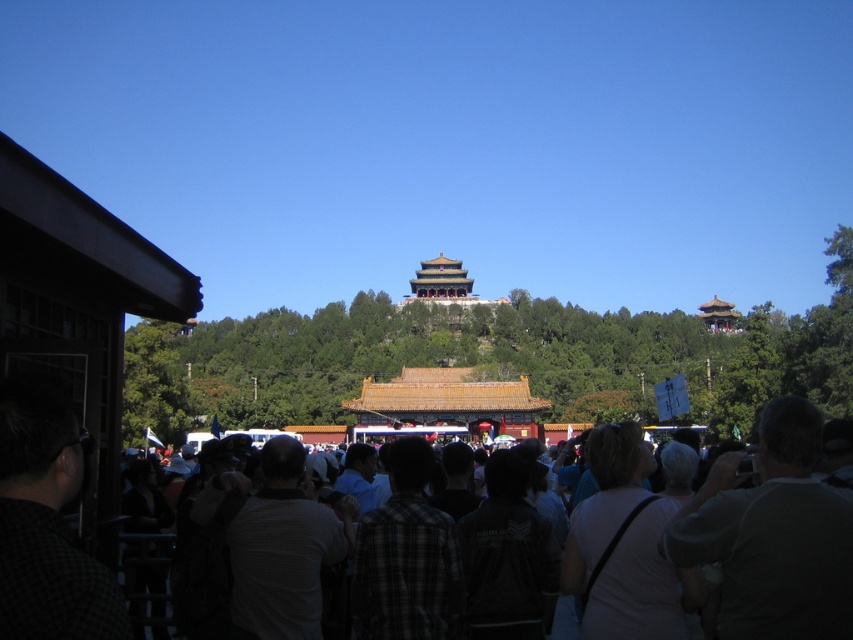
Which is below, black checkered shirt at left or dark plaid shirt at center?

Positioned lower is dark plaid shirt at center.

Which is in front, point (15, 381) or point (489, 605)?

Point (15, 381) is in front.

Between point (3, 499) and point (508, 524), which one is positioned behind?

The point (508, 524) is more distant.

Locate an element on the screen. black checkered shirt at left is located at coordinates (45, 522).

Is point (38, 449) more distant than point (219, 493)?

No, (38, 449) is closer to viewer.

The image size is (853, 640). What do you see at coordinates (45, 522) in the screenshot?
I see `black checkered shirt at left` at bounding box center [45, 522].

Where is `black checkered shirt at left`? This screenshot has height=640, width=853. black checkered shirt at left is located at coordinates (45, 522).

Can you confirm if dark gray shirt at center is positioned to the right of dark plaid shirt at center?

No, dark gray shirt at center is not to the right of dark plaid shirt at center.

This screenshot has width=853, height=640. Find the location of `dark gray shirt at center`. dark gray shirt at center is located at coordinates (792, 538).